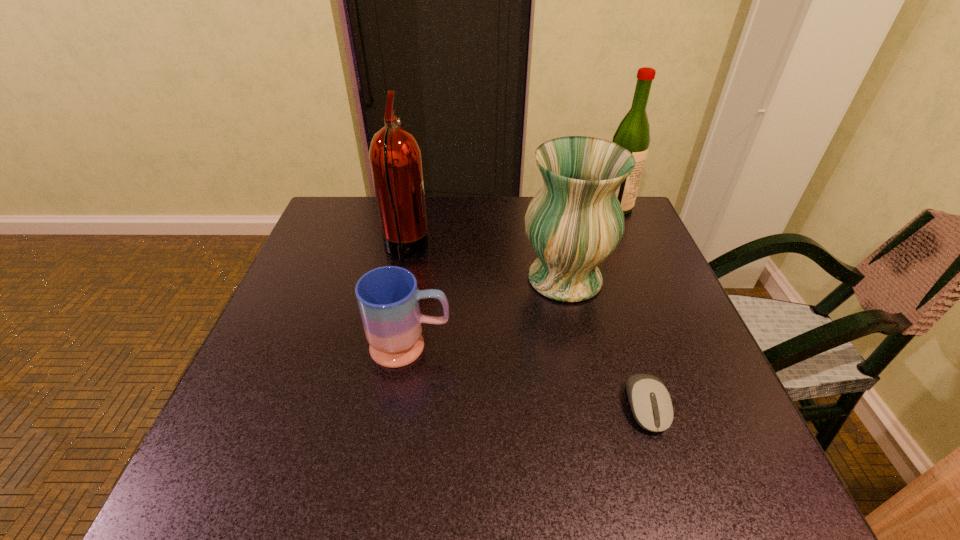
At what (x,y) coordinates should I click in order to perform the action: click on blank space at the far edge of the desktop. Please return your answer as a coordinate pair (x, y). The height and width of the screenshot is (540, 960). Looking at the image, I should click on (456, 228).

In the image, there is a desktop. At what (x,y) coordinates should I click in order to perform the action: click on vacant space at the near edge. Please return your answer as a coordinate pair (x, y). Looking at the image, I should click on (358, 455).

In the image, there is a desktop. Identify the location of vacant space at the left edge. tap(288, 338).

Identify the location of free space at the right edge of the desktop. (703, 440).

Locate an element on the screen. The height and width of the screenshot is (540, 960). free space at the far left corner of the desktop is located at coordinates (347, 246).

Locate an element on the screen. This screenshot has width=960, height=540. free point at the near left corner is located at coordinates (287, 477).

Find the location of a particular element. This screenshot has width=960, height=540. vacant space at the far right corner of the desktop is located at coordinates (642, 227).

Locate an element on the screen. vacant area that lies between the fire extinguisher and the computer equipment is located at coordinates (526, 328).

Where is `free space between the rightmost object and the fourth farthest object`? This screenshot has height=540, width=960. free space between the rightmost object and the fourth farthest object is located at coordinates (514, 277).

Find the location of a particular element. This screenshot has width=960, height=540. free space between the fire extinguisher and the third tallest object is located at coordinates point(485,264).